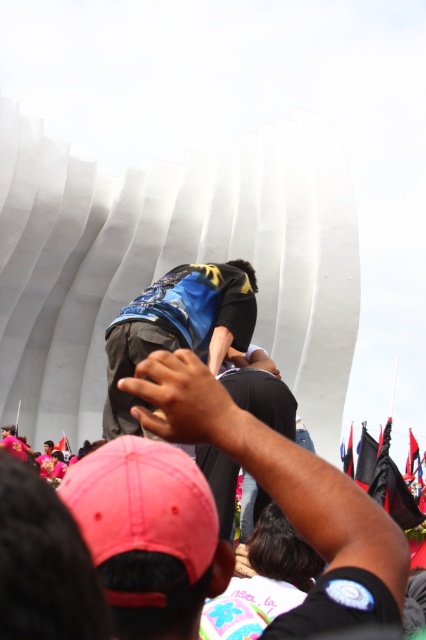
You are standing at the point with coordinates point (127, 310) and want to move to the point with coordinates point (370, 561). Which direction should you move to get closer to your destination?

To move from point (127, 310) to point (370, 561), you should move towards the upper right direction since point (370, 561) is closer to the viewer than point (127, 310).